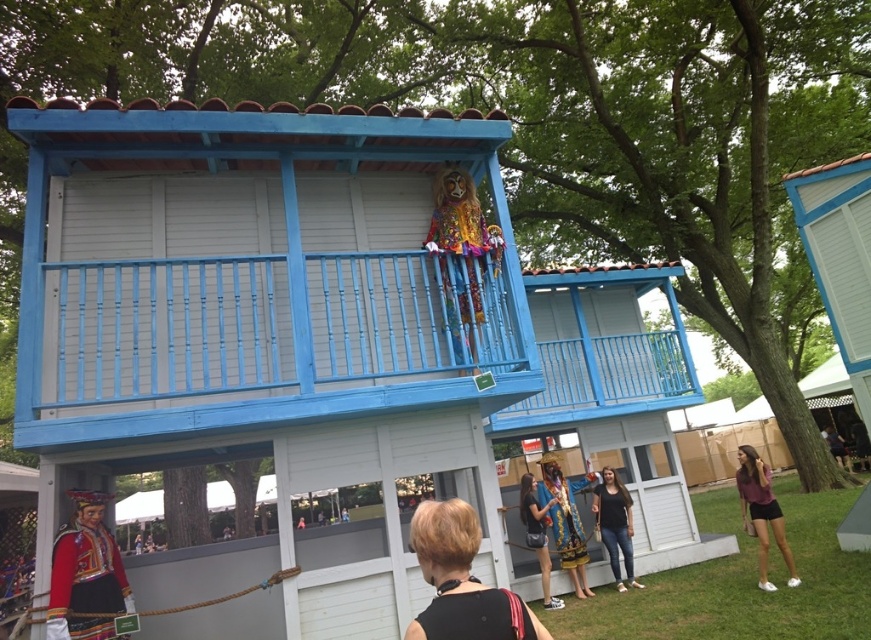
Question: Estimate the real-world distances between objects in this image. Which object is closer to the matte black dress at center?

Choices:
 (A) gold metallic statue at center
 (B) matte burgundy blouse at lower right
 (C) blue painted wood balcony at upper center

Answer: (A)

Question: Is red velvet costume at lower left wider than matte burgundy blouse at lower right?

Choices:
 (A) no
 (B) yes

Answer: (A)

Question: Which point is closer to the camera taking this photo?

Choices:
 (A) (111, 624)
 (B) (437, 621)
 (C) (586, 472)
 (D) (544, 556)

Answer: (B)

Question: Does blue painted wood balcony at upper center have a larger size compared to jeans at center?

Choices:
 (A) no
 (B) yes

Answer: (B)

Question: Which point appears farthest from the camera in this image?

Choices:
 (A) (437, 563)
 (B) (100, 492)
 (C) (745, 499)
 (D) (71, 256)

Answer: (C)

Question: Is blue painted wood balcony at upper center closer to camera compared to red velvet costume at lower left?

Choices:
 (A) no
 (B) yes

Answer: (B)